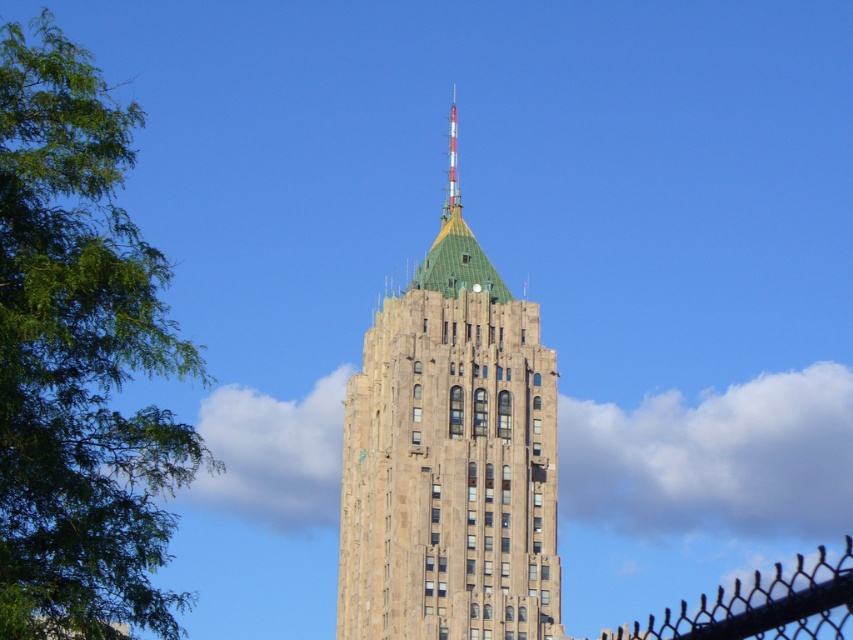
You are standing in a park and see the green leafy tree at left and the brown stone building at center. If you walk straight ahead, which one will disappear first from your view if the tree and building are aligned along your path?

The green leafy tree at left will disappear first from your view because it is positioned to the left of the brown stone building at center, meaning it is closer to you along your path.